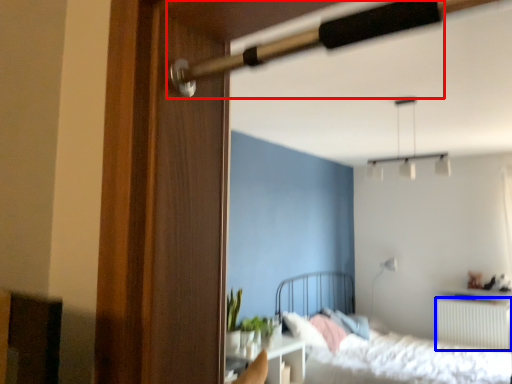
Question: Which point is further to the camera, door handle (highlighted by a red box) or radiator (highlighted by a blue box)?

Choices:
 (A) door handle
 (B) radiator

Answer: (B)